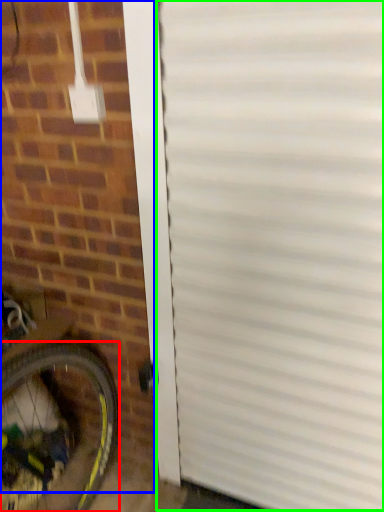
Question: Which is farther away from bicycle wheel (highlighted by a red box)? brickwork (highlighted by a blue box) or garage door (highlighted by a green box)?

Choices:
 (A) brickwork
 (B) garage door

Answer: (B)